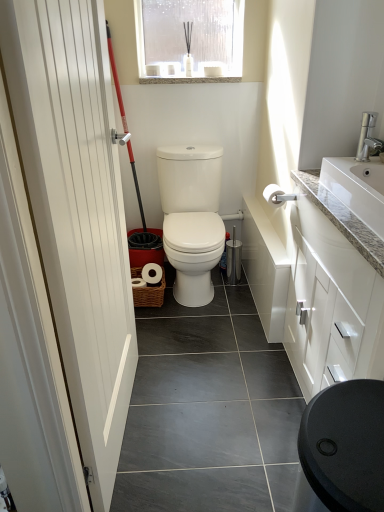
Describe the element at coordinates (274, 194) in the screenshot. I see `white matte toilet paper at upper right` at that location.

What is the approximate height of translucent plastic window at upper center?

translucent plastic window at upper center is 16.06 inches in height.

The image size is (384, 512). Identify the location of white granite sink at upper right. (359, 179).

Which of these two, silver metallic faucet at upper right or white smooth door at left, is wider?

Wider between the two is white smooth door at left.

Looking at this image, from a real-world perspective, who is located lower, silver metallic faucet at upper right or white smooth door at left?

white smooth door at left is physically lower.

Locate an element on the screen. This screenshot has height=512, width=384. tap above the white smooth door at left (from a real-world perspective) is located at coordinates (368, 138).

From their relative heights in the image, would you say silver metallic faucet at upper right is taller or shorter than white smooth door at left?

In the image, silver metallic faucet at upper right appears to be shorter than white smooth door at left.

Could white granite sink at upper right be considered to be inside silver metallic faucet at upper right?

No, white granite sink at upper right is located outside of silver metallic faucet at upper right.

From a real-world perspective, who is located higher, silver metallic faucet at upper right or white granite sink at upper right?

In real-world perspective, silver metallic faucet at upper right is above.

Does point (372, 119) appear closer or farther from the camera than point (346, 201)?

Point (372, 119) is farther from the camera than point (346, 201).

I want to click on sink in front of the silver metallic faucet at upper right, so click(x=359, y=179).

How far apart are white smooth door at left and white matte toilet paper at upper right?

white smooth door at left and white matte toilet paper at upper right are 3.61 feet apart.

Considering their positions, is white smooth door at left located in front of or behind white matte toilet paper at upper right?

Clearly, white smooth door at left is in front of white matte toilet paper at upper right.

Where is `toilet paper that appears below the white smooth door at left (from a real-world perspective)`? toilet paper that appears below the white smooth door at left (from a real-world perspective) is located at coordinates (274, 194).

From the image's perspective, is white smooth door at left under white matte toilet paper at upper right?

Yes, from the image's perspective, white smooth door at left is beneath white matte toilet paper at upper right.

Looking at this image, is translucent plastic window at upper center placed right next to white smooth door at left?

translucent plastic window at upper center is not next to white smooth door at left, and they're not touching.

Considering the sizes of objects translucent plastic window at upper center and white smooth door at left in the image provided, who is smaller, translucent plastic window at upper center or white smooth door at left?

translucent plastic window at upper center is smaller.

Which of these two, white granite sink at upper right or translucent plastic window at upper center, stands shorter?

white granite sink at upper right is shorter.

From the image's perspective, which one is positioned lower, white granite sink at upper right or translucent plastic window at upper center?

white granite sink at upper right, from the image's perspective.

Does white granite sink at upper right have a greater width compared to translucent plastic window at upper center?

Indeed, white granite sink at upper right has a greater width compared to translucent plastic window at upper center.

Between silver metallic faucet at upper right and translucent plastic window at upper center, which one is positioned in front?

silver metallic faucet at upper right is closer to the camera.

From a real-world perspective, which is physically below, silver metallic faucet at upper right or translucent plastic window at upper center?

In real-world perspective, silver metallic faucet at upper right is lower.

Which object is thinner, silver metallic faucet at upper right or translucent plastic window at upper center?

Thinner between the two is silver metallic faucet at upper right.

Which object is thinner, translucent plastic window at upper center or white granite sink at upper right?

translucent plastic window at upper center.

From the image's perspective, would you say translucent plastic window at upper center is positioned over white granite sink at upper right?

Indeed, from the image's perspective, translucent plastic window at upper center is shown above white granite sink at upper right.

In order to click on sink on the right of translucent plastic window at upper center in this screenshot , I will do `click(359, 179)`.

Can you tell me how much translucent plastic window at upper center and white granite sink at upper right differ in facing direction?

The angular difference between translucent plastic window at upper center and white granite sink at upper right is 90 degrees.

This screenshot has width=384, height=512. I want to click on door that is under the silver metallic faucet at upper right (from a real-world perspective), so click(77, 210).

The height and width of the screenshot is (512, 384). I want to click on sink located below the silver metallic faucet at upper right (from the image's perspective), so click(359, 179).

Estimate the real-world distances between objects in this image. Which object is closer to white matte toilet paper at upper right, translucent plastic window at upper center or white smooth door at left?

translucent plastic window at upper center is positioned closer to the anchor white matte toilet paper at upper right.

Which object lies nearer to the anchor point white matte toilet paper at upper right, silver metallic faucet at upper right or white granite sink at upper right?

silver metallic faucet at upper right is closer to white matte toilet paper at upper right.

Which object lies further to the anchor point white smooth door at left, silver metallic faucet at upper right or translucent plastic window at upper center?

The object further to white smooth door at left is translucent plastic window at upper center.

Based on their spatial positions, is white smooth door at left or white matte toilet paper at upper right further from white granite sink at upper right?

Among the two, white smooth door at left is located further to white granite sink at upper right.

Looking at the image, which one is located further to white matte toilet paper at upper right, white smooth door at left or translucent plastic window at upper center?

white smooth door at left lies further to white matte toilet paper at upper right than the other object.

Based on the photo, which object lies nearer to the anchor point translucent plastic window at upper center, silver metallic faucet at upper right or white granite sink at upper right?

Among the two, silver metallic faucet at upper right is located nearer to translucent plastic window at upper center.

Estimate the real-world distances between objects in this image. Which object is further from translucent plastic window at upper center, white granite sink at upper right or white smooth door at left?

white smooth door at left lies further to translucent plastic window at upper center than the other object.

When comparing their distances from silver metallic faucet at upper right, does translucent plastic window at upper center or white matte toilet paper at upper right seem further?

translucent plastic window at upper center.

Locate an element on the screen. The height and width of the screenshot is (512, 384). sink positioned between white smooth door at left and translucent plastic window at upper center from near to far is located at coordinates (359, 179).

Find the location of a particular element. toilet paper that lies between translucent plastic window at upper center and white granite sink at upper right from top to bottom is located at coordinates (274, 194).

Find the location of a particular element. toilet paper between white smooth door at left and translucent plastic window at upper center along the z-axis is located at coordinates (274, 194).

You are a GUI agent. You are given a task and a screenshot of the screen. Output one action in this format:
    pyautogui.click(x=<x>, y=<y>)
    Task: Click on the tap between white granite sink at upper right and translucent plastic window at upper center from front to back
    Image resolution: width=384 pixels, height=512 pixels.
    Given the screenshot: What is the action you would take?
    pyautogui.click(x=368, y=138)